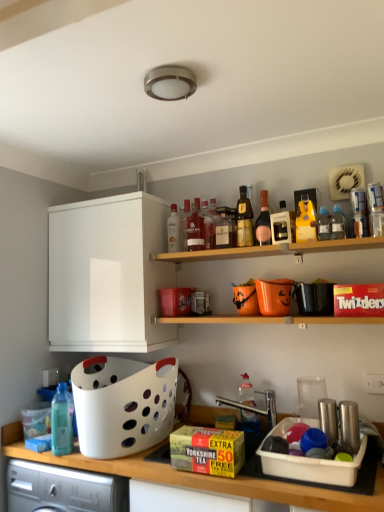
Locate an element on the screen. The width and height of the screenshot is (384, 512). free space in front of black plastic bag at upper right, the second appliance ordered from the bottom is located at coordinates pos(341,314).